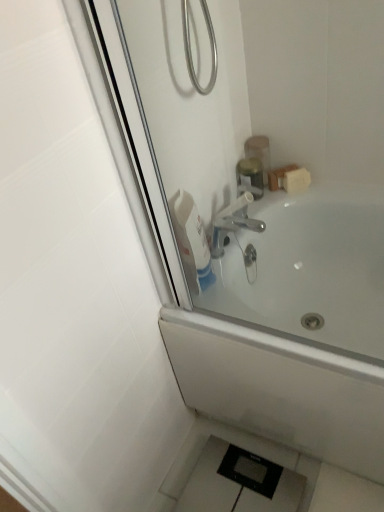
Question: From a real-world perspective, is white glossy bathtub at upper center physically located above or below white glossy bottle at upper center?

Choices:
 (A) below
 (B) above

Answer: (A)

Question: In terms of height, does white glossy bathtub at upper center look taller or shorter compared to white glossy bottle at upper center?

Choices:
 (A) short
 (B) tall

Answer: (B)

Question: Estimate the real-world distances between objects in this image. Which object is farther from the metallic gold container at upper center, marked as the second toiletry in a bottom-to-top arrangement?

Choices:
 (A) white glossy bottle at upper center
 (B) metallic silver soap dispenser at upper right, arranged as the first toiletry when ordered from the bottom
 (C) white glossy bathtub at upper center

Answer: (C)

Question: Which is farther from the metallic gold container at upper center, marked as the second toiletry in a bottom-to-top arrangement?

Choices:
 (A) white glossy bathtub at upper center
 (B) white glossy bottle at upper center
 (C) metallic silver soap dispenser at upper right, arranged as the first toiletry when ordered from the bottom

Answer: (A)